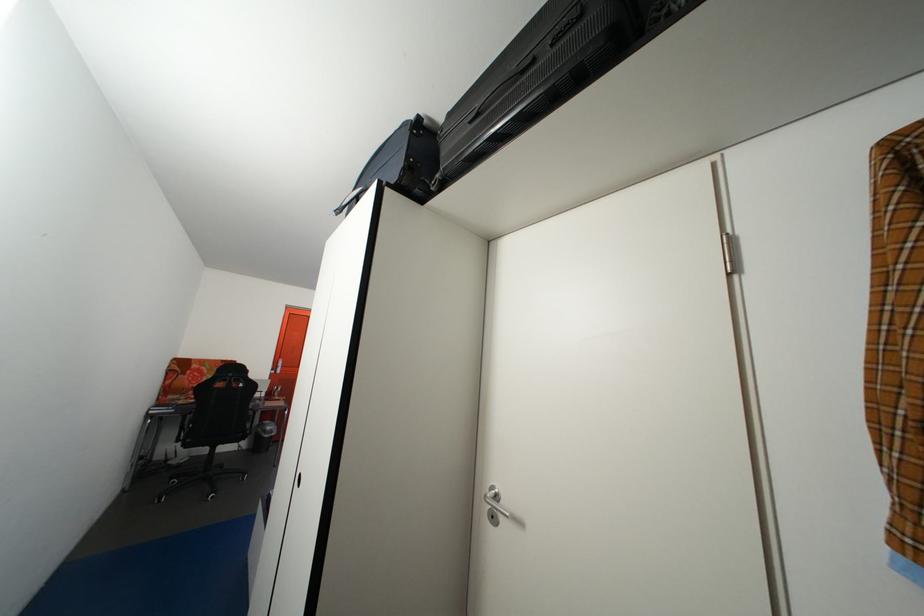
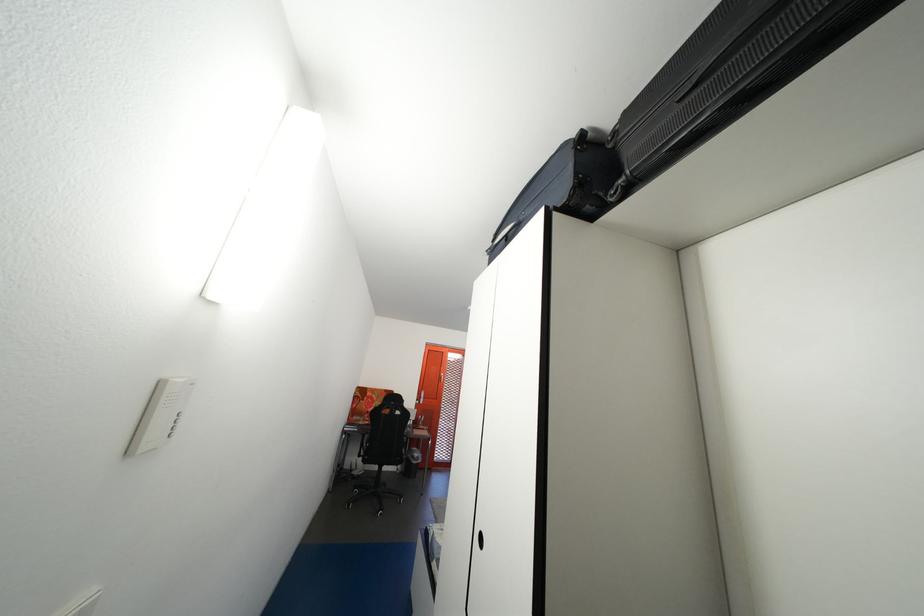
Question: Which direction would the cameraman need to move to produce the second image? Reply with the corresponding letter.

Choices:
 (A) Left
 (B) Right
 (C) Forward
 (D) Backward

Answer: (A)